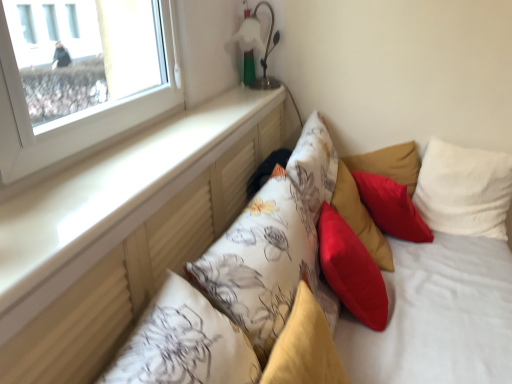
Question: Should I look upward or downward to see fluffy yellow pillow at center, the second pillow from the left?

Choices:
 (A) up
 (B) down

Answer: (B)

Question: Can you confirm if fluffy yellow pillow at center, the second pillow from the left, is positioned to the left of white soft pillow at upper right, arranged as the first pillow when viewed from the right?

Choices:
 (A) no
 (B) yes

Answer: (B)

Question: Is white soft pillow at upper right, arranged as the first pillow when viewed from the right, located within fluffy yellow pillow at center, the second pillow from the left?

Choices:
 (A) no
 (B) yes

Answer: (A)

Question: Is fluffy yellow pillow at center, which is counted as the 5th pillow, starting from the right, wider than white soft pillow at upper right, arranged as the first pillow when viewed from the right?

Choices:
 (A) yes
 (B) no

Answer: (B)

Question: Is fluffy yellow pillow at center, which is counted as the 5th pillow, starting from the right, positioned behind white soft pillow at upper right, which is the sixth pillow from left to right?

Choices:
 (A) yes
 (B) no

Answer: (B)

Question: From a real-world perspective, is fluffy yellow pillow at center, which is counted as the 5th pillow, starting from the right, over white soft pillow at upper right, which is the sixth pillow from left to right?

Choices:
 (A) no
 (B) yes

Answer: (A)

Question: From the image's perspective, is fluffy yellow pillow at center, which is counted as the 5th pillow, starting from the right, above white soft pillow at upper right, which is the sixth pillow from left to right?

Choices:
 (A) no
 (B) yes

Answer: (A)

Question: Does floral fabric pillow at center, which is the 6th pillow in right-to-left order, have a greater height compared to silky red cushion at center, the fourth pillow when ordered from left to right?

Choices:
 (A) no
 (B) yes

Answer: (B)

Question: Is floral fabric pillow at center, arranged as the 1th pillow when viewed from the left, thinner than silky red cushion at center, which is the 3th pillow from right to left?

Choices:
 (A) yes
 (B) no

Answer: (B)

Question: Does floral fabric pillow at center, arranged as the 1th pillow when viewed from the left, turn towards silky red cushion at center, the fourth pillow when ordered from left to right?

Choices:
 (A) yes
 (B) no

Answer: (B)

Question: Does floral fabric pillow at center, arranged as the 1th pillow when viewed from the left, come behind silky red cushion at center, which is the 3th pillow from right to left?

Choices:
 (A) no
 (B) yes

Answer: (A)

Question: Is floral fabric pillow at center, which is the 6th pillow in right-to-left order, outside silky red cushion at center, which is the 3th pillow from right to left?

Choices:
 (A) yes
 (B) no

Answer: (A)

Question: From the image's perspective, is floral fabric pillow at center, which is the 6th pillow in right-to-left order, located above silky red cushion at center, which is the 3th pillow from right to left?

Choices:
 (A) no
 (B) yes

Answer: (A)

Question: From the image's perspective, is fluffy yellow pillow at center, which is counted as the 5th pillow, starting from the right, below metallic silver table lamp at upper center?

Choices:
 (A) no
 (B) yes

Answer: (B)